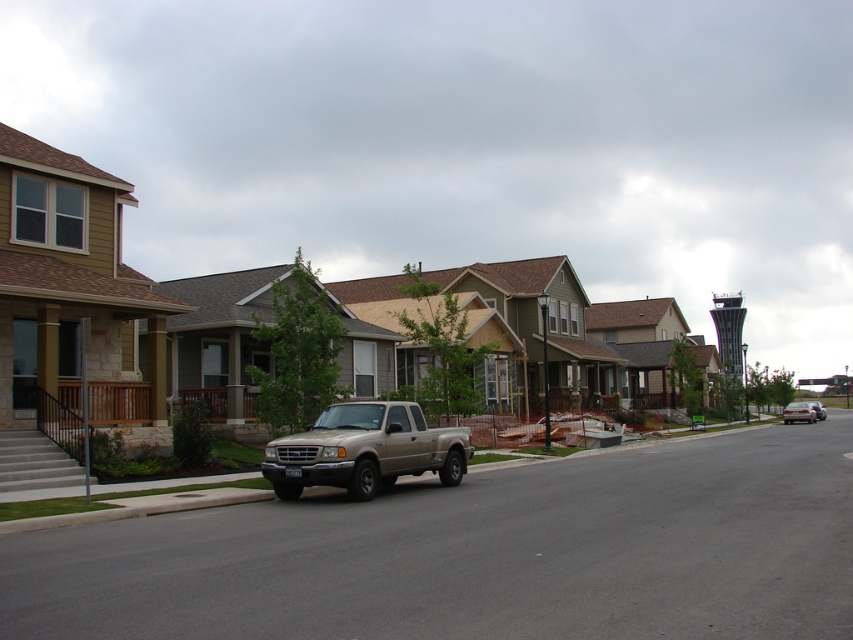
Question: Does gold metallic truck at center have a smaller size compared to silver metallic sedan at right?

Choices:
 (A) yes
 (B) no

Answer: (A)

Question: Which point is farther to the camera?

Choices:
 (A) silver metallic sedan at right
 (B) metallic silver sedan at center
 (C) gold metallic truck at center

Answer: (B)

Question: Estimate the real-world distances between objects in this image. Which object is farther from the metallic silver sedan at center?

Choices:
 (A) gold metallic truck at center
 (B) silver metallic sedan at right

Answer: (A)

Question: Can you confirm if gold metallic truck at center is bigger than metallic silver sedan at center?

Choices:
 (A) no
 (B) yes

Answer: (A)

Question: Which point is closer to the camera?

Choices:
 (A) (810, 403)
 (B) (787, 410)

Answer: (B)

Question: Does gold metallic truck at center have a smaller size compared to metallic silver sedan at center?

Choices:
 (A) no
 (B) yes

Answer: (B)